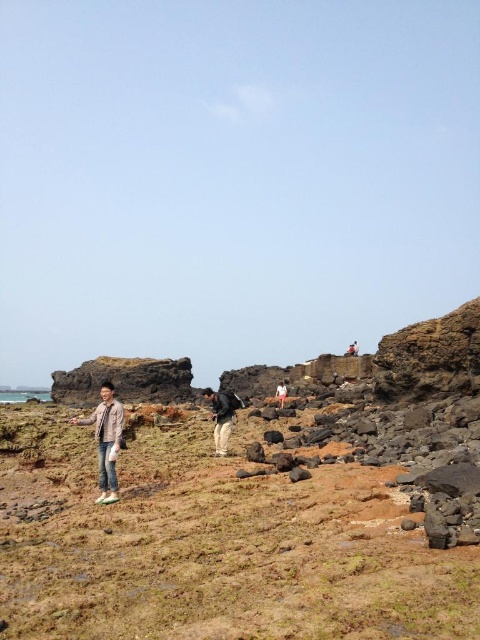
You are a photographer trying to capture a wide shot of the coastal landscape. You have a camera with a 50mm lens and need to ensure both the brown grassy terrain at lower left and the light brown leather jacket at center are in the frame. Can you fit both subjects into the shot from your current position?

The brown grassy terrain at lower left and light brown leather jacket at center are 12.20 meters apart. With a 50mm lens, which has a field of view of approximately 46 degrees, it is possible to capture both subjects in the frame if they are within the camera sensor and lens combination. However, the exact framing would depend on the camera sensor size and distance from the subjects. If positioned correctly, both subjects can be included.

You are hiking along the coast and need to place your matte black backpack at center on the ground. Which direction should you place it so that it doesn not block the brown grassy terrain at lower left?

The brown grassy terrain at lower left is positioned on the left side of matte black backpack at center. To avoid blocking the brown grassy terrain at lower left, you should place the matte black backpack at center to the right of the brown grassy terrain at lower left.

You are standing at the center of the coastal scene. You need to place a small marker at the exact location of the brown grassy terrain at lower left. What are the coordinates where you should place the marker?

The coordinates for the brown grassy terrain at lower left are at point (213, 545).